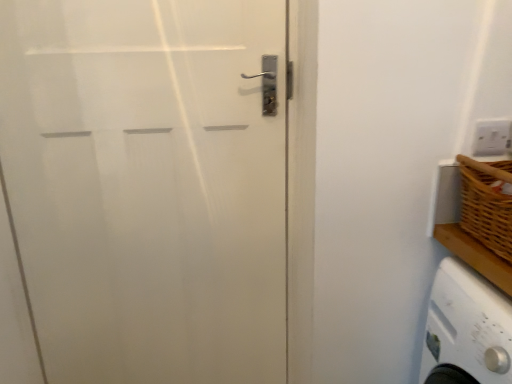
Question: From a real-world perspective, is white matte door at left physically located above or below white plastic electric outlet at upper right?

Choices:
 (A) above
 (B) below

Answer: (B)

Question: From the image's perspective, is white matte door at left located above or below white plastic electric outlet at upper right?

Choices:
 (A) below
 (B) above

Answer: (A)

Question: Considering the positions of point (281, 326) and point (503, 129), is point (281, 326) closer or farther from the camera than point (503, 129)?

Choices:
 (A) farther
 (B) closer

Answer: (A)

Question: Is white plastic electric outlet at upper right wider or thinner than white matte door at left?

Choices:
 (A) wide
 (B) thin

Answer: (B)

Question: Relative to white matte door at left, is white plastic electric outlet at upper right in front or behind?

Choices:
 (A) front
 (B) behind

Answer: (B)

Question: In terms of size, does white plastic electric outlet at upper right appear bigger or smaller than white matte door at left?

Choices:
 (A) small
 (B) big

Answer: (A)

Question: Is white plastic electric outlet at upper right to the left or to the right of white matte door at left in the image?

Choices:
 (A) right
 (B) left

Answer: (A)